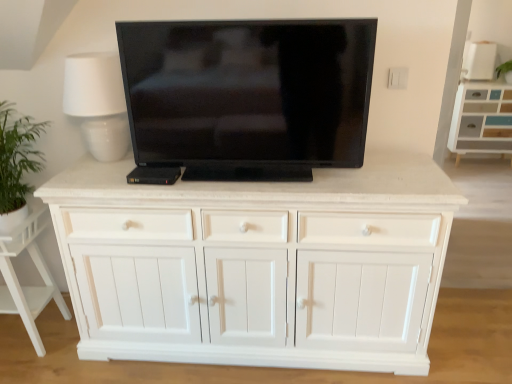
Question: Is white wood cabinet at lower left to the left or to the right of black glossy tv at center in the image?

Choices:
 (A) left
 (B) right

Answer: (A)

Question: Is white wood cabinet at lower left in front of or behind black glossy tv at center in the image?

Choices:
 (A) behind
 (B) front

Answer: (A)

Question: Which object is positioned closest to the black glossy tv at center?

Choices:
 (A) white ceramic table lamp at upper left
 (B) white wood cabinet at lower left
 (C) white wood cabinet at upper right

Answer: (A)

Question: Estimate the real-world distances between objects in this image. Which object is closer to the white ceramic table lamp at upper left?

Choices:
 (A) white wood cabinet at lower left
 (B) black glossy tv at center
 (C) white wood cabinet at upper right

Answer: (B)